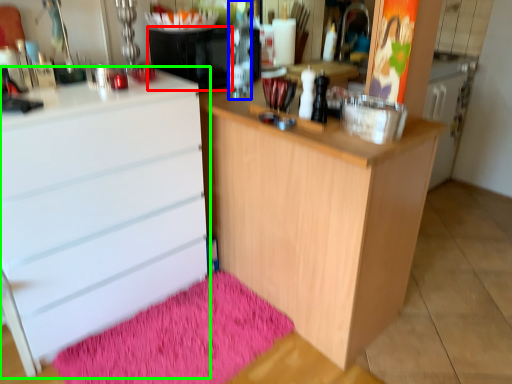
Question: Which is farther away from appliance (highlighted by a red box)? bottle (highlighted by a blue box) or chest of drawers (highlighted by a green box)?

Choices:
 (A) bottle
 (B) chest of drawers

Answer: (B)